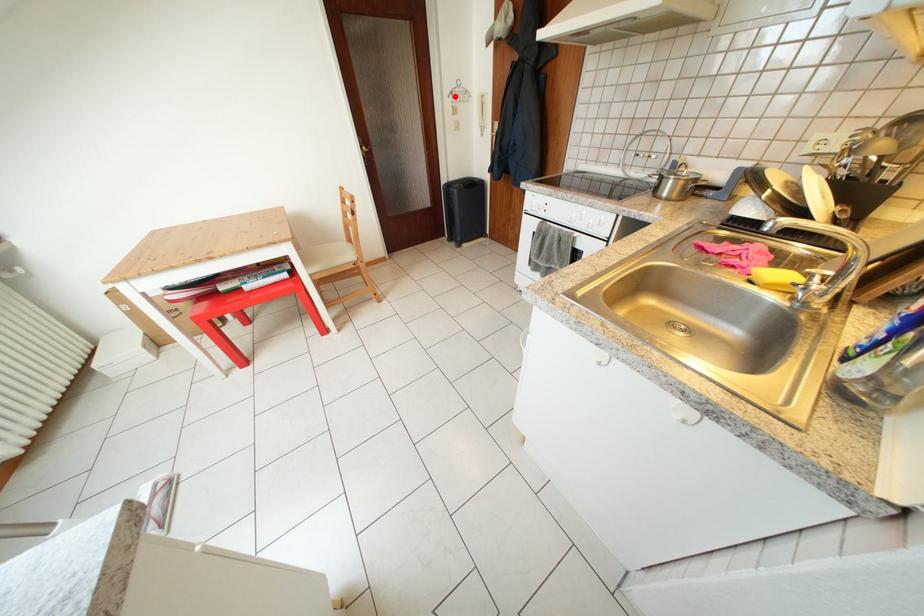
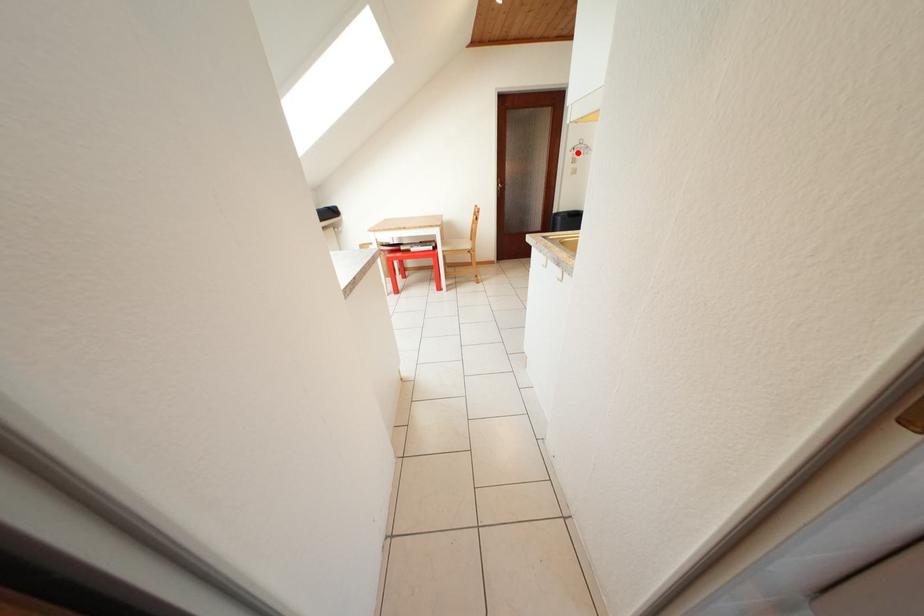
I am providing you with two images of the same scene from different viewpoints. A red point is marked on the first image and another point is marked on the second image. Is the red point in image1 aligned with the point shown in image2?

Yes